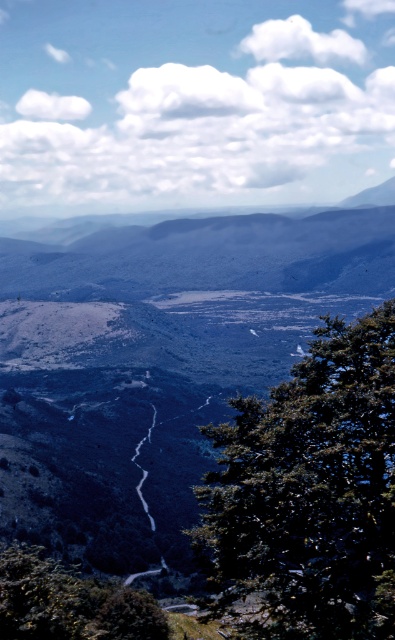
Question: Which object is closer to the camera taking this photo?

Choices:
 (A) green leafy tree at center
 (B) green leafy tree at lower left

Answer: (A)

Question: Does green leafy tree at center appear under green leafy tree at lower left?

Choices:
 (A) yes
 (B) no

Answer: (B)

Question: Is green leafy tree at center to the right of green leafy tree at lower left from the viewer's perspective?

Choices:
 (A) no
 (B) yes

Answer: (B)

Question: Among these points, which one is farthest from the camera?

Choices:
 (A) (274, 528)
 (B) (3, 608)

Answer: (B)

Question: Which of the following is the closest to the observer?

Choices:
 (A) green leafy tree at center
 (B) green leafy tree at lower left

Answer: (A)

Question: Is green leafy tree at center behind green leafy tree at lower left?

Choices:
 (A) no
 (B) yes

Answer: (A)